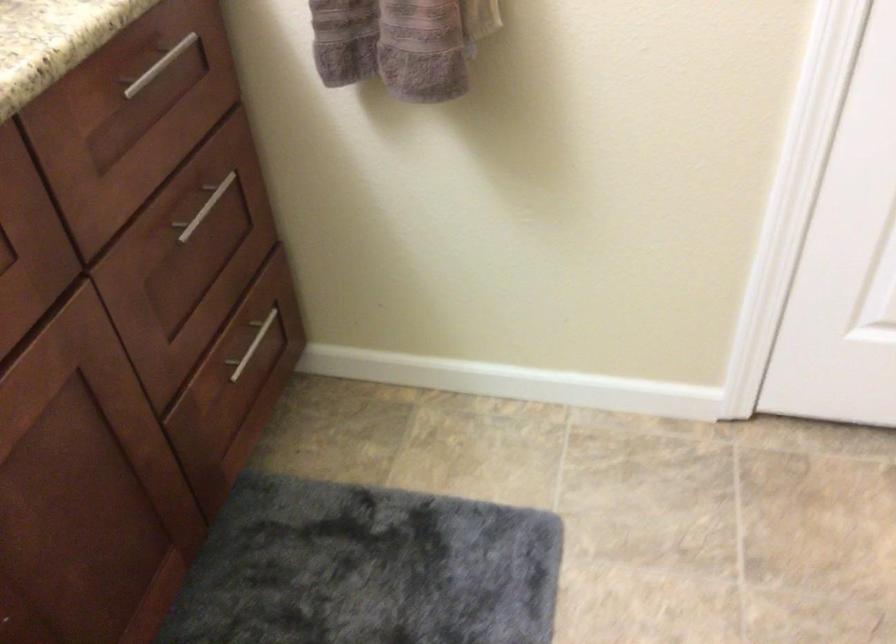
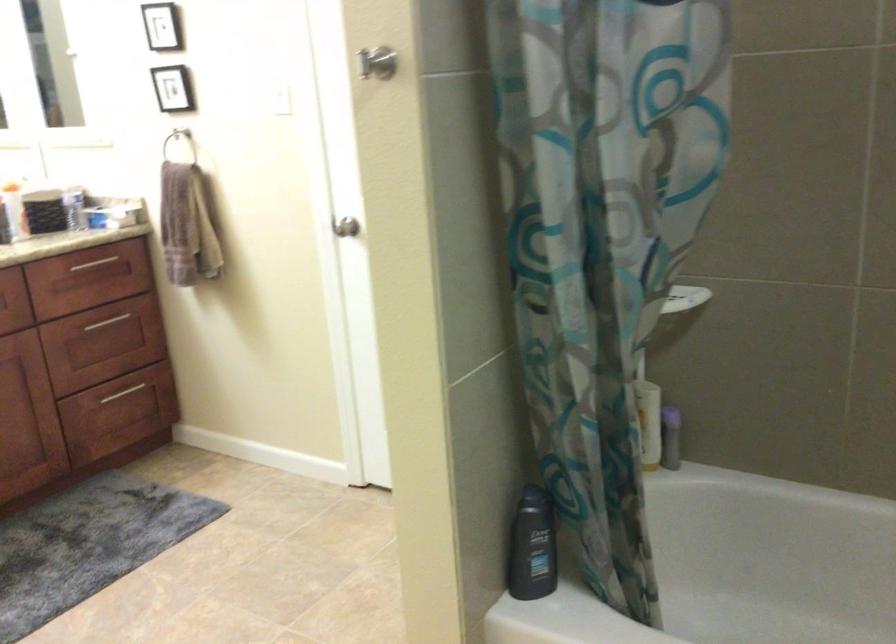
In the second image, find the point that corresponds to pixel 220 218 in the first image.

(115, 323)